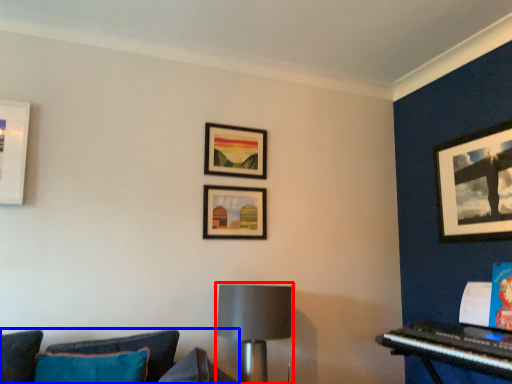
Question: Which of the following is the closest to the observer, lamp (highlighted by a red box) or studio couch (highlighted by a blue box)?

Choices:
 (A) lamp
 (B) studio couch

Answer: (B)